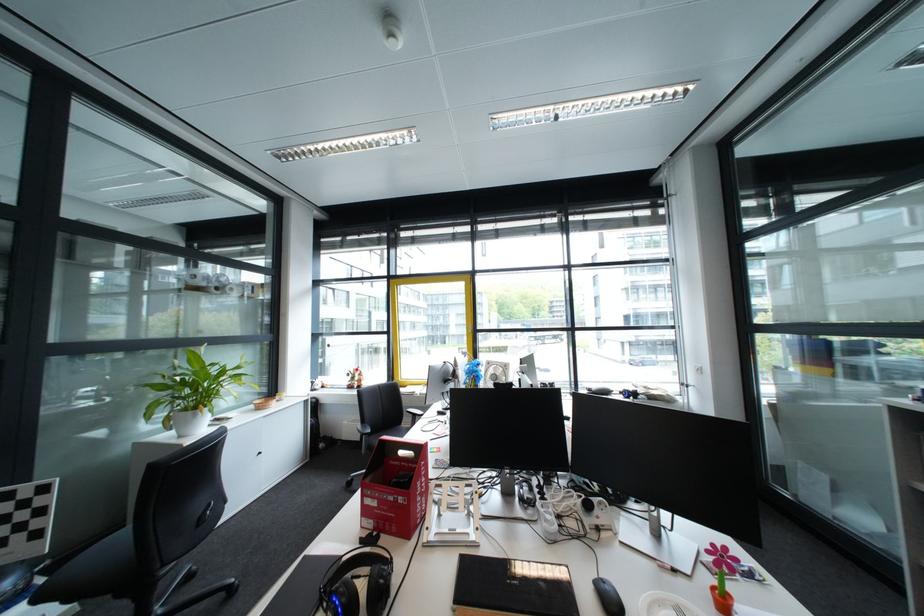
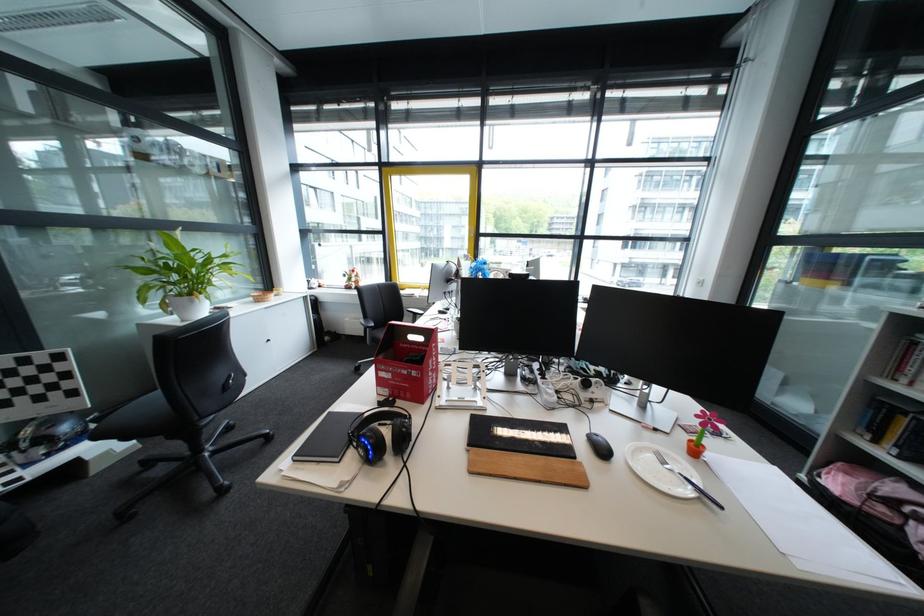
Locate, in the second image, the point that corresponds to point (79, 554) in the first image.

(120, 410)